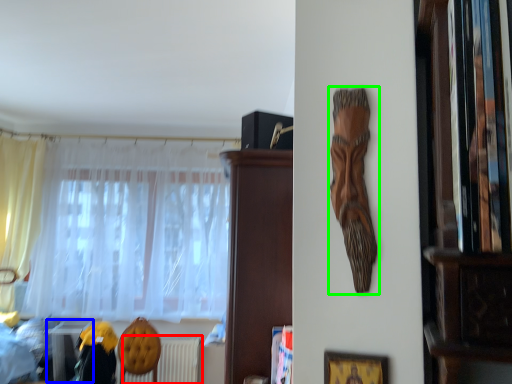
Question: Which object is the farthest from radiator (highlighted by a red box)? Choose among these: table (highlighted by a blue box) or person (highlighted by a green box).

Choices:
 (A) table
 (B) person

Answer: (B)